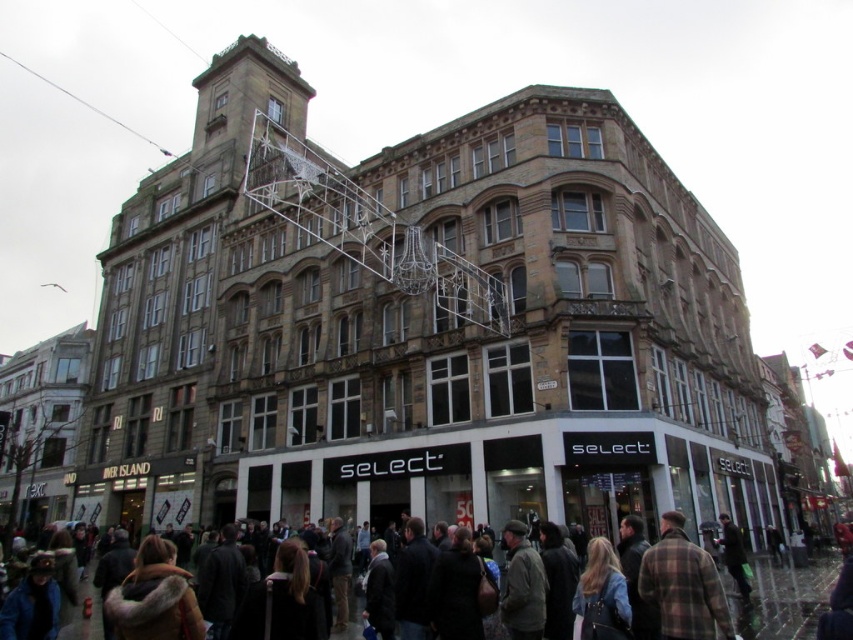
Is metallic silver scaffolding at upper center closer to camera compared to dark brown leather jackets at lower center?

No.

Is point (310, 227) more distant than point (676, 515)?

Yes.

The width and height of the screenshot is (853, 640). Find the location of `metallic silver scaffolding at upper center`. metallic silver scaffolding at upper center is located at coordinates (364, 228).